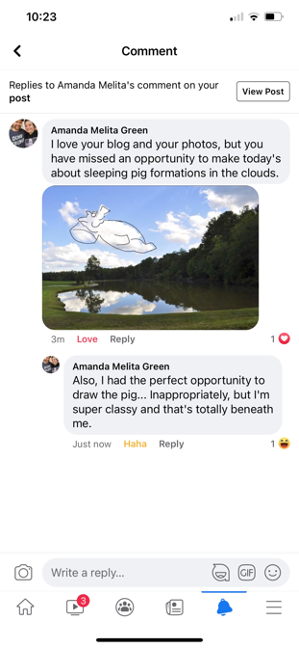
The height and width of the screenshot is (648, 299). What are the coordinates of `picture` in the screenshot? It's located at (149, 210).